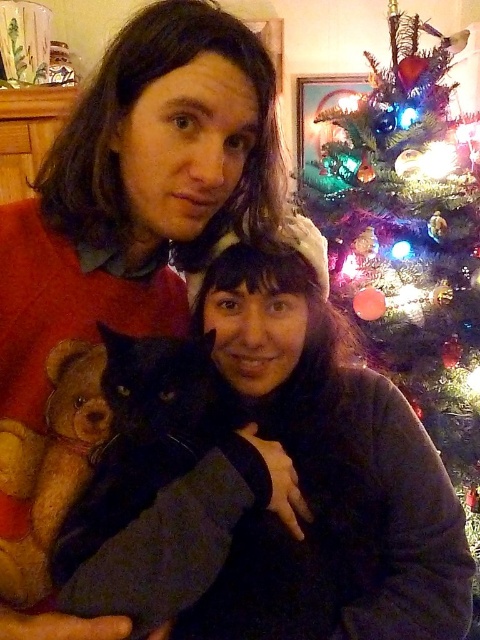
Is point (202, 362) farther from viewer compared to point (72, 454)?

That is False.

Between point (123, 448) and point (80, 406), which one is positioned in front?

Point (123, 448) is more forward.

Where is `black fur cat at center`? black fur cat at center is located at coordinates pyautogui.click(x=151, y=436).

Who is more forward, (336,282) or (183,348)?

Point (183,348) is in front.

Between green matte christmas tree at upper right and black fur cat at center, which one has more height?

green matte christmas tree at upper right is taller.

Is point (382, 301) more distant than point (108, 516)?

Yes, point (382, 301) is farther from viewer.

Find the location of a particular element. This screenshot has width=480, height=640. green matte christmas tree at upper right is located at coordinates (408, 237).

Can you confirm if green matte christmas tree at upper right is positioned above light brown plush teddy bear at left?

Yes, green matte christmas tree at upper right is above light brown plush teddy bear at left.

Does point (420, 323) come behind point (61, 388)?

Yes.

The width and height of the screenshot is (480, 640). What are the coordinates of `green matte christmas tree at upper right` in the screenshot? It's located at (408, 237).